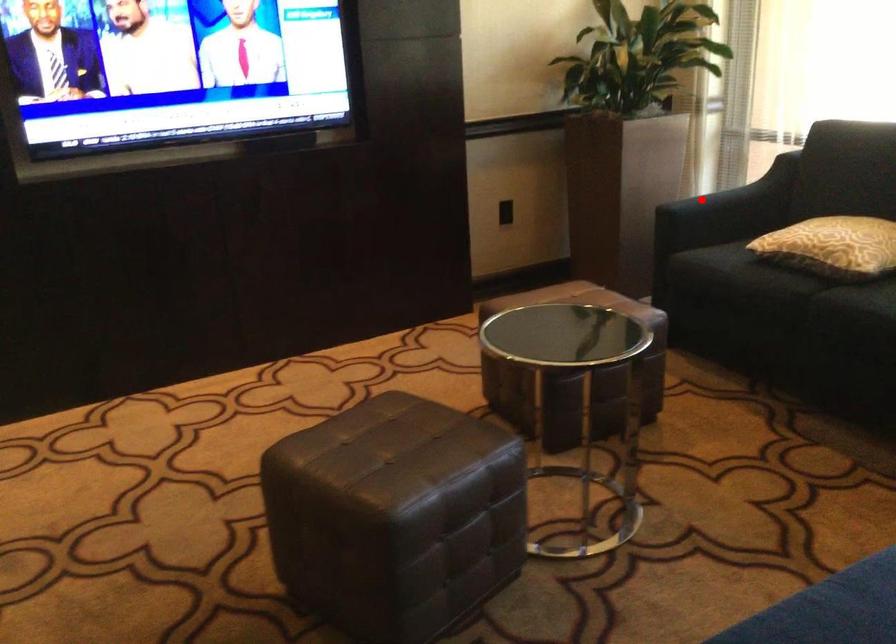
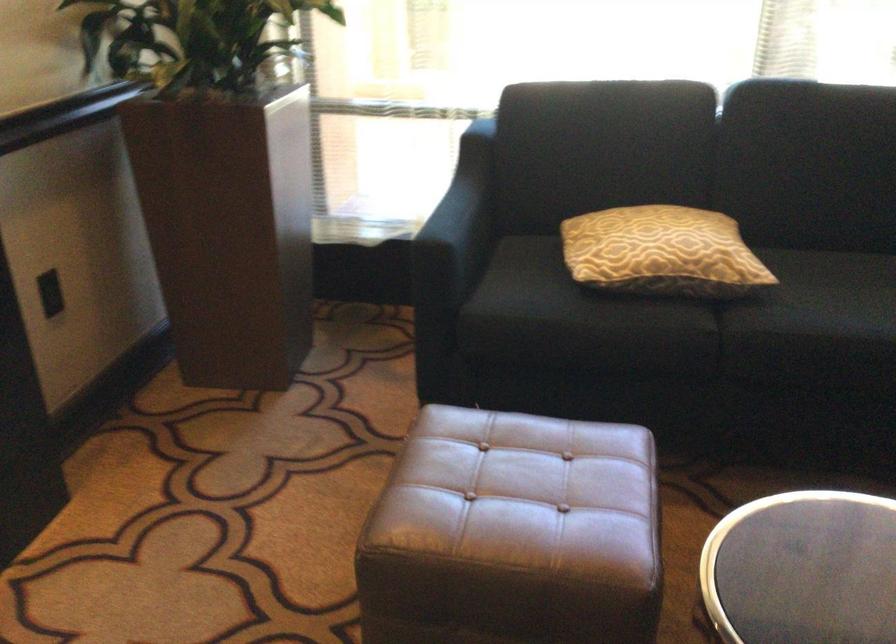
Question: I am providing you with two images of the same scene from different viewpoints. A red point is shown in image1. For the corresponding object point in image2, is it positioned nearer or farther from the camera?

Choices:
 (A) Nearer
 (B) Farther

Answer: (A)